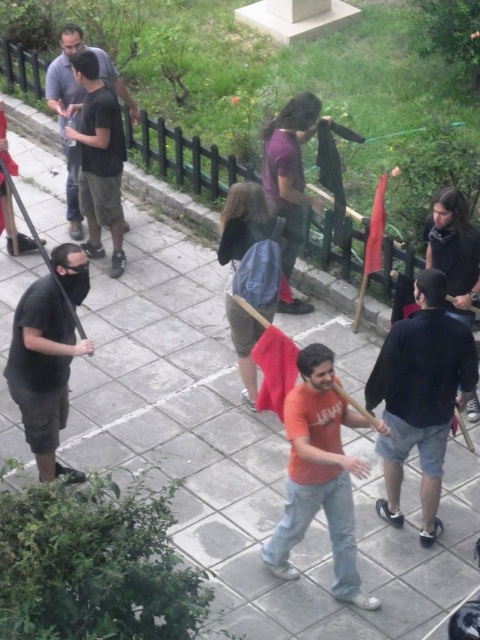
You are standing at the edge of the paved area in the park and see the purple matte shirt at center and the denim shorts at center. From your perspective, which one is positioned to the right?

The purple matte shirt at center is to the right of the denim shorts at center.